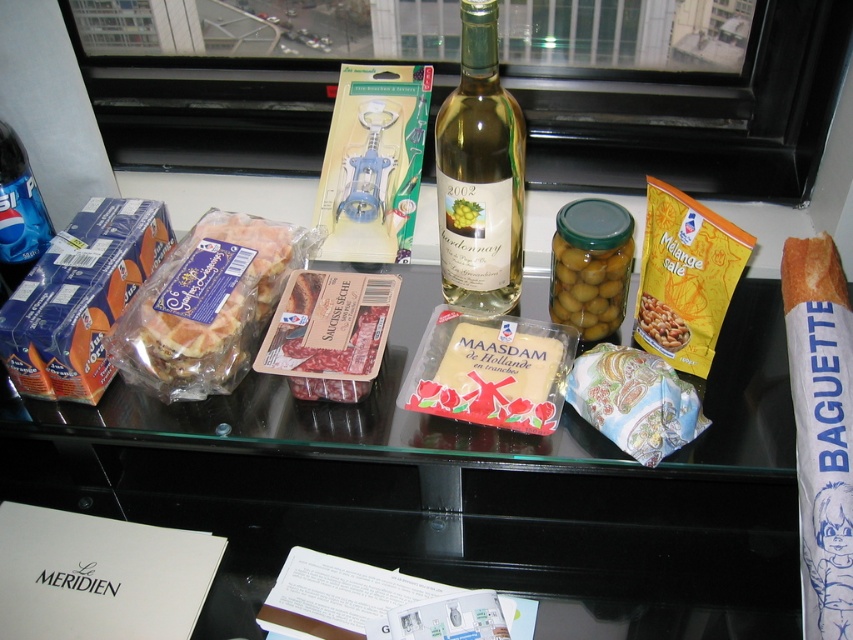
Who is higher up, green glass bottle at center or dark red glossy meat at center?

green glass bottle at center is above.

Is point (518, 273) farther from viewer compared to point (368, 384)?

Yes, point (518, 273) is behind point (368, 384).

At what (x,y) coordinates should I click in order to perform the action: click on green glass bottle at center. Please return your answer as a coordinate pair (x, y). Looking at the image, I should click on (x=480, y=173).

Is dark red glossy meat at center in front of green glass jar at center?

That is True.

Can you confirm if dark red glossy meat at center is positioned below green glass jar at center?

Indeed, dark red glossy meat at center is positioned under green glass jar at center.

Which is in front, point (258, 365) or point (599, 250)?

Point (599, 250)

Locate an element on the screen. The width and height of the screenshot is (853, 640). dark red glossy meat at center is located at coordinates (329, 333).

Is green glass bottle at center below yellow paper bag of melange salé at center right?

Actually, green glass bottle at center is above yellow paper bag of melange salé at center right.

Does green glass bottle at center have a greater height compared to yellow paper bag of melange salé at center right?

Yes, green glass bottle at center is taller than yellow paper bag of melange salé at center right.

Does point (453, 227) come farther from viewer compared to point (720, 314)?

That is True.

You are a GUI agent. You are given a task and a screenshot of the screen. Output one action in this format:
    pyautogui.click(x=<x>, y=<y>)
    Task: Click on the green glass bottle at center
    
    Given the screenshot: What is the action you would take?
    pyautogui.click(x=480, y=173)